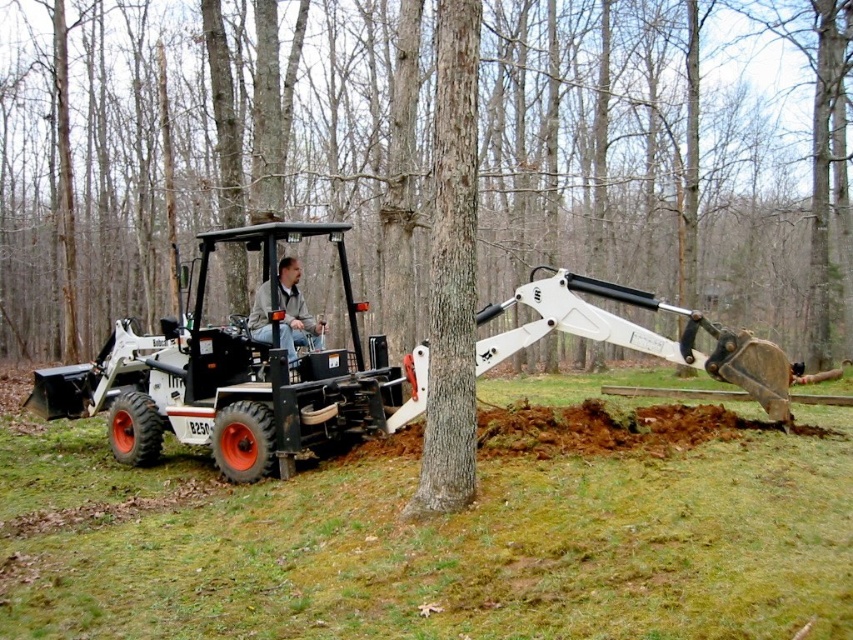
Can you confirm if brown rough bark tree trunk at center is positioned above leather jacket at center?

Correct, brown rough bark tree trunk at center is located above leather jacket at center.

Who is positioned more to the right, brown rough bark tree trunk at center or leather jacket at center?

brown rough bark tree trunk at center is more to the right.

Locate an element on the screen. The image size is (853, 640). brown rough bark tree trunk at center is located at coordinates (451, 268).

Identify the location of brown rough bark tree trunk at center. The width and height of the screenshot is (853, 640). (451, 268).

Can you confirm if black rubber tractor at center is positioned to the right of brown rough bark tree trunk at center?

No, black rubber tractor at center is not to the right of brown rough bark tree trunk at center.

Is black rubber tractor at center to the left of brown rough bark tree trunk at center from the viewer's perspective?

Correct, you'll find black rubber tractor at center to the left of brown rough bark tree trunk at center.

Which is behind, point (299, 362) or point (456, 280)?

The point (299, 362) is behind.

Find the location of a particular element. black rubber tractor at center is located at coordinates (235, 380).

Measure the distance from smooth bark tree at center to black rubber tractor at center.

They are 17.05 meters apart.

How far apart are smooth bark tree at center and black rubber tractor at center?

smooth bark tree at center is 55.94 feet from black rubber tractor at center.

Image resolution: width=853 pixels, height=640 pixels. What are the coordinates of `smooth bark tree at center` in the screenshot? It's located at (207, 156).

You are a GUI agent. You are given a task and a screenshot of the screen. Output one action in this format:
    pyautogui.click(x=<x>, y=<y>)
    Task: Click on the smooth bark tree at center
    
    Given the screenshot: What is the action you would take?
    click(207, 156)